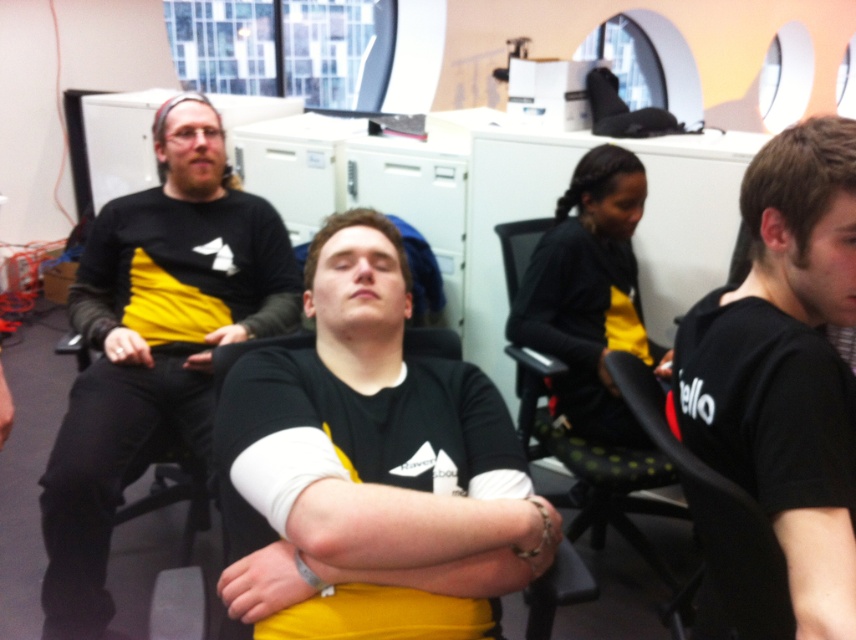
Question: Can you confirm if black matte shirt at center is positioned below yellow matte shirt at left?

Choices:
 (A) yes
 (B) no

Answer: (A)

Question: Does black matte shirt at center have a larger size compared to black matte arm at right?

Choices:
 (A) yes
 (B) no

Answer: (A)

Question: Which object appears farthest from the camera in this image?

Choices:
 (A) black mesh chair at center
 (B) black matte shirt at center
 (C) matte black shirt at left

Answer: (A)

Question: Is black matte shirt at right to the left of black matte arm at right from the viewer's perspective?

Choices:
 (A) no
 (B) yes

Answer: (A)

Question: Which of the following is the farthest from the observer?

Choices:
 (A) (810, 237)
 (B) (581, 472)
 (C) (293, 442)
 (D) (823, 600)

Answer: (B)

Question: Which object is the closest to the black mesh chair at right?

Choices:
 (A) black matte shirt at right
 (B) black mesh chair at center
 (C) black matte arm at right

Answer: (C)